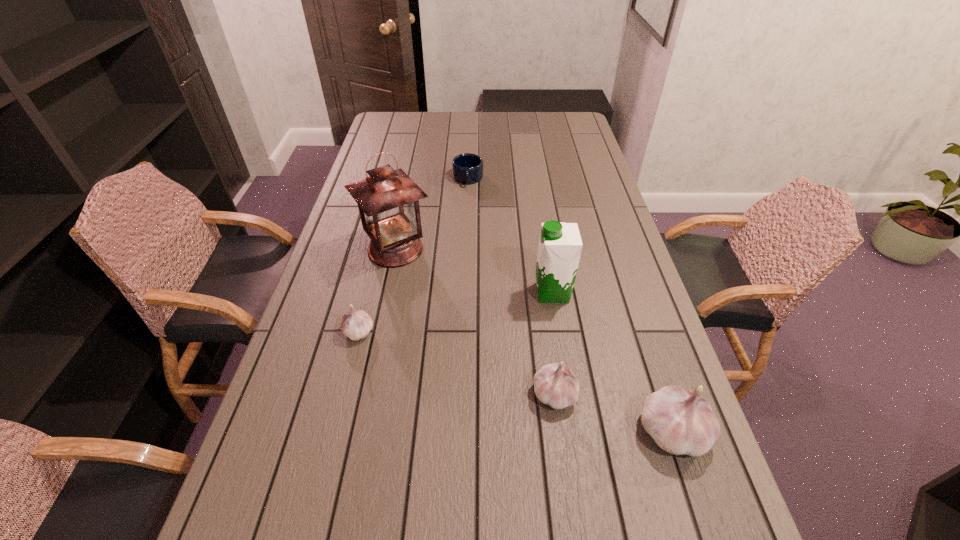
Locate an element on the screen. This screenshot has height=540, width=960. vacant area that lies between the tallest garlic and the second farthest object is located at coordinates (534, 341).

Find the location of a particular element. vacant area between the fourth tallest object and the shortest garlic is located at coordinates (457, 363).

You are a GUI agent. You are given a task and a screenshot of the screen. Output one action in this format:
    pyautogui.click(x=<x>, y=<y>)
    Task: Click on the unoccupied area between the second tallest garlic and the second tallest object
    
    Given the screenshot: What is the action you would take?
    pyautogui.click(x=554, y=343)

Where is `vacant area between the third tallest object and the third object from left to right`? This screenshot has width=960, height=540. vacant area between the third tallest object and the third object from left to right is located at coordinates (570, 305).

This screenshot has width=960, height=540. Identify the location of vacant space that's between the second garlic from left to right and the mug. point(511,286).

Find the location of a particular element. The image size is (960, 540). vacant point located between the shortest object and the third farthest object is located at coordinates (510, 235).

Where is `vacant area that lies between the rightmost garlic and the second farthest object`? vacant area that lies between the rightmost garlic and the second farthest object is located at coordinates (534, 341).

What are the coordinates of `unoccupied area between the rightmost object and the shortest object` in the screenshot? It's located at (570, 305).

Find the location of a particular element. free area in between the mug and the third shortest object is located at coordinates (511, 286).

You are a GUI agent. You are given a task and a screenshot of the screen. Output one action in this format:
    pyautogui.click(x=<x>, y=<y>)
    Task: Click on the free space that is in between the fourth tallest object and the soya milk
    This screenshot has width=960, height=540.
    Given the screenshot: What is the action you would take?
    pyautogui.click(x=554, y=343)